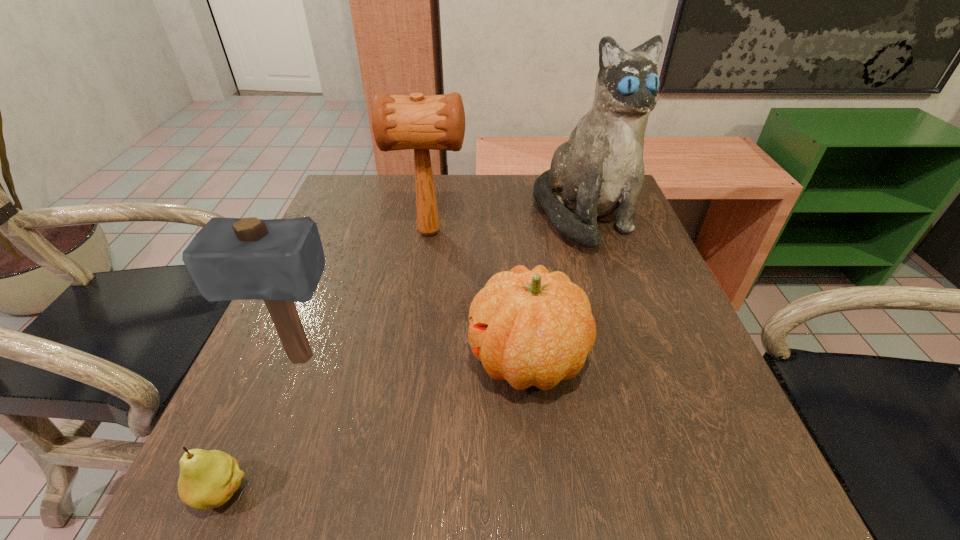
The image size is (960, 540). Identify the location of vacant space located on the carved face of the second shortest object. (342, 359).

Locate an element on the screen. This screenshot has width=960, height=540. vacant space located on the carved face of the second shortest object is located at coordinates (402, 359).

Locate an element on the screen. This screenshot has width=960, height=540. vacant space located on the carved face of the second shortest object is located at coordinates (280, 359).

Find the location of a particular element. The image size is (960, 540). free space located 0.170m on the back of the nearest object is located at coordinates (274, 371).

Where is `cat that is at the far edge`? Image resolution: width=960 pixels, height=540 pixels. cat that is at the far edge is located at coordinates (599, 170).

Locate an element on the screen. mallet situated at the far edge is located at coordinates (437, 122).

Locate an element on the screen. The height and width of the screenshot is (540, 960). object that is positioned at the near edge is located at coordinates (208, 479).

Locate an element on the screen. mallet that is at the left edge is located at coordinates (280, 261).

I want to click on pear located in the left edge section of the desktop, so click(x=208, y=479).

Identify the location of object that is positioned at the right edge. The width and height of the screenshot is (960, 540). click(599, 170).